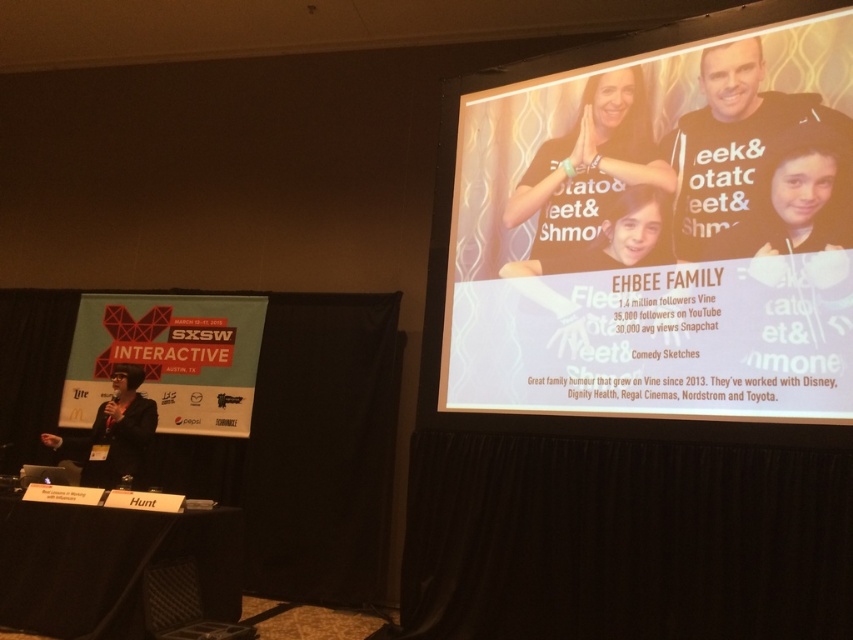
Question: Observing the image, what is the correct spatial positioning of white glossy projection screen at upper right in reference to black matte jacket at left?

Choices:
 (A) below
 (B) above

Answer: (B)

Question: Which object appears closest to the camera in this image?

Choices:
 (A) white t-shirt at upper right
 (B) white glossy projection screen at upper right

Answer: (B)

Question: Which object is farther from the camera taking this photo?

Choices:
 (A) matte white banner at left
 (B) black matte jacket at left
 (C) matte black t-shirt at upper right

Answer: (A)

Question: Does white glossy projection screen at upper right appear over matte black t-shirt at upper right?

Choices:
 (A) yes
 (B) no

Answer: (B)

Question: Which object is farther from the camera taking this photo?

Choices:
 (A) matte white banner at left
 (B) matte black t-shirt at upper right
 (C) white t-shirt at upper right
 (D) white glossy projection screen at upper right

Answer: (A)

Question: Is white glossy projection screen at upper right wider than black matte jacket at left?

Choices:
 (A) no
 (B) yes

Answer: (B)